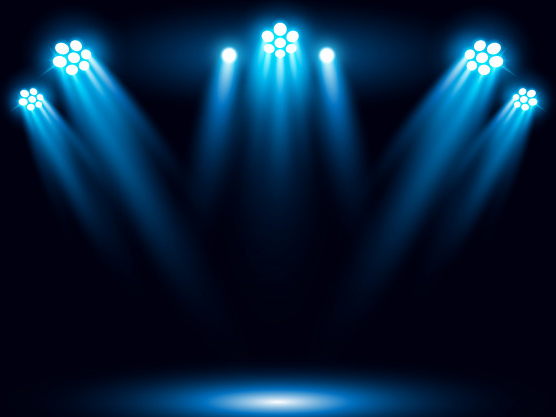
You are a GUI agent. You are given a task and a screenshot of the screen. Output one action in this format:
    pyautogui.click(x=<x>, y=<y>)
    Task: Click on the spot lights
    
    Given the screenshot: What is the action you would take?
    pyautogui.click(x=32, y=100), pyautogui.click(x=69, y=65), pyautogui.click(x=277, y=39), pyautogui.click(x=529, y=98), pyautogui.click(x=332, y=49), pyautogui.click(x=229, y=48)